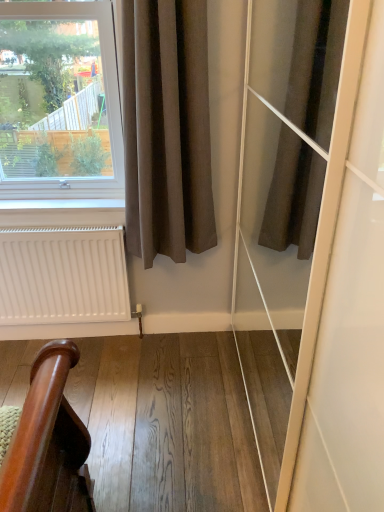
Question: Considering the relative sizes of wooden handrail at lower left and brown cotton curtain at left in the image provided, is wooden handrail at lower left taller than brown cotton curtain at left?

Choices:
 (A) no
 (B) yes

Answer: (A)

Question: Is wooden handrail at lower left thinner than brown cotton curtain at left?

Choices:
 (A) no
 (B) yes

Answer: (A)

Question: Is wooden handrail at lower left in front of brown cotton curtain at left?

Choices:
 (A) yes
 (B) no

Answer: (B)

Question: From a real-world perspective, is wooden handrail at lower left positioned over brown cotton curtain at left based on gravity?

Choices:
 (A) no
 (B) yes

Answer: (A)

Question: Can you confirm if wooden handrail at lower left is positioned to the right of brown cotton curtain at left?

Choices:
 (A) yes
 (B) no

Answer: (B)

Question: From the image's perspective, is wooden handrail at lower left located above brown cotton curtain at left?

Choices:
 (A) no
 (B) yes

Answer: (A)

Question: Is white matte radiator at lower left completely or partially inside brown cotton curtain at left?

Choices:
 (A) yes
 (B) no

Answer: (B)

Question: Is brown cotton curtain at left not close to white matte radiator at lower left?

Choices:
 (A) no
 (B) yes

Answer: (A)

Question: Does brown cotton curtain at left appear on the left side of white matte radiator at lower left?

Choices:
 (A) yes
 (B) no

Answer: (B)

Question: Is brown cotton curtain at left positioned beyond the bounds of white matte radiator at lower left?

Choices:
 (A) yes
 (B) no

Answer: (A)

Question: Is brown cotton curtain at left positioned in front of white matte radiator at lower left?

Choices:
 (A) no
 (B) yes

Answer: (B)

Question: From a real-world perspective, is brown cotton curtain at left located higher than white matte radiator at lower left?

Choices:
 (A) no
 (B) yes

Answer: (B)

Question: Can wooden handrail at lower left be found inside white matte radiator at lower left?

Choices:
 (A) no
 (B) yes

Answer: (A)